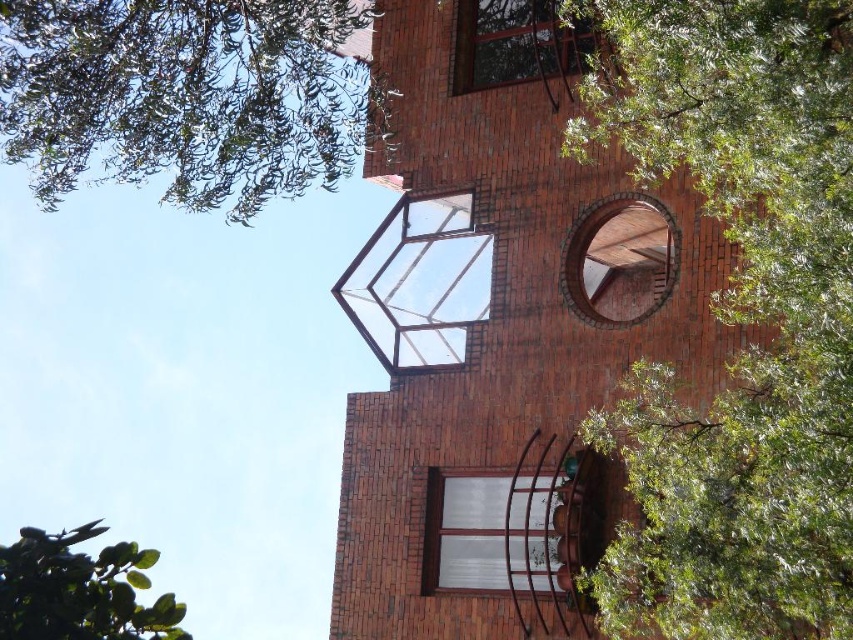
Question: Does red brick tower at center have a smaller size compared to green leafy tree at upper left?

Choices:
 (A) yes
 (B) no

Answer: (B)

Question: Is green leafy tree at upper left positioned at the back of white glass window at center?

Choices:
 (A) no
 (B) yes

Answer: (A)

Question: Among these points, which one is nearest to the camera?

Choices:
 (A) (534, 29)
 (B) (448, 552)
 (C) (91, 609)

Answer: (C)

Question: Where is clear glass window at center located in relation to white glass window at center in the image?

Choices:
 (A) right
 (B) left

Answer: (B)

Question: Considering the real-world distances, which object is closest to the green leafy tree at lower left?

Choices:
 (A) clear glass window at center
 (B) red brick window at upper right
 (C) green leafy tree at upper left

Answer: (C)

Question: Which point appears closest to the camera in this image?

Choices:
 (A) (491, 76)
 (B) (613, 225)

Answer: (A)